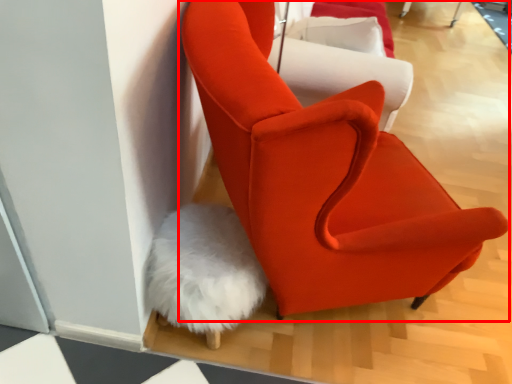
Question: From the image's perspective, what is the correct spatial positioning of chair (annotated by the red box) in reference to chair?

Choices:
 (A) below
 (B) above

Answer: (A)